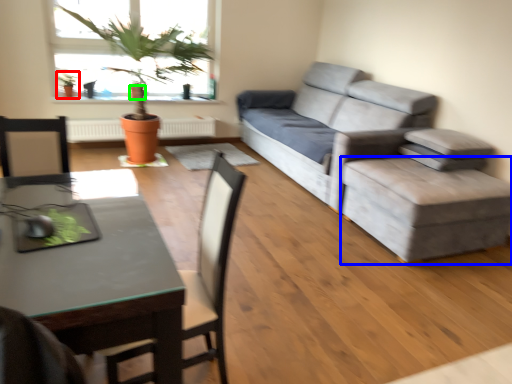
Question: Which object is the closest to the houseplant (highlighted by a red box)? Choose among these: stool (highlighted by a blue box) or flowerpot (highlighted by a green box).

Choices:
 (A) stool
 (B) flowerpot

Answer: (B)